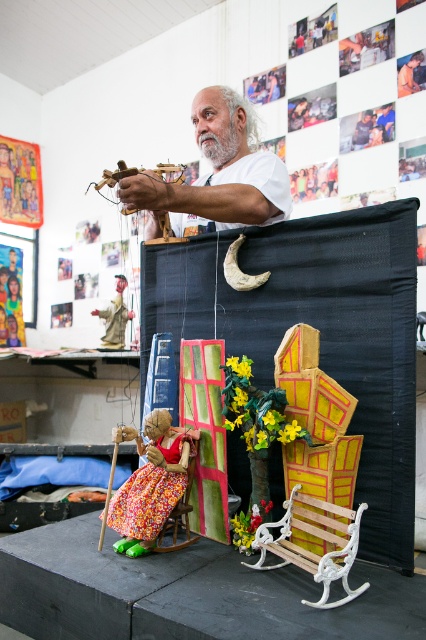
Question: Is white matte man at upper center closer to camera compared to wooden bench at lower right?

Choices:
 (A) yes
 (B) no

Answer: (B)

Question: Does wooden bench at lower right come behind matte brown puppet at center?

Choices:
 (A) yes
 (B) no

Answer: (B)

Question: Which of the following is the closest to the observer?

Choices:
 (A) matte brown puppet at center
 (B) matte fabric doll at center

Answer: (B)

Question: Which object appears farthest from the camera in this image?

Choices:
 (A) matte brown puppet at center
 (B) matte fabric doll at center
 (C) wooden bench at lower right

Answer: (A)

Question: Which object is positioned farthest from the matte brown puppet at center?

Choices:
 (A) wooden bench at lower right
 (B) white matte man at upper center

Answer: (A)

Question: Can you confirm if wooden bench at lower right is thinner than matte brown puppet at center?

Choices:
 (A) no
 (B) yes

Answer: (A)